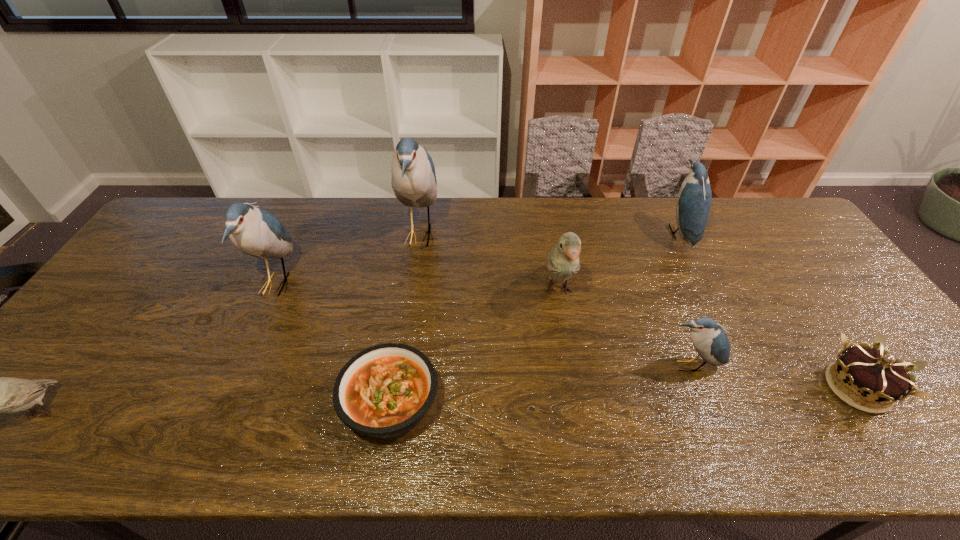
Image resolution: width=960 pixels, height=540 pixels. What are the coordinates of `bird that stands as the fourth closest to the farther white bird` in the screenshot? It's located at (254, 231).

Select which bird is the fifth closest to the leftmost bird. Please provide its 2D coordinates. Your answer should be formatted as a tuple, i.e. [(x, y)], where the tuple contains the x and y coordinates of a point satisfying the conditions above.

[(694, 198)]

This screenshot has height=540, width=960. Find the location of `blue bird that can be found as the fourth closest to the shortest object`. blue bird that can be found as the fourth closest to the shortest object is located at coordinates (694, 198).

Locate an element on the screen. The width and height of the screenshot is (960, 540). blue bird that is the fourth closest to the right white bird is located at coordinates (254, 231).

In order to click on free space in the image that satisfies the following two spatial constraints: 1. at the tip of the seventh tallest object's beak; 2. on the right side of the smallest blue bird in this screenshot , I will do `click(698, 388)`.

At what (x,y) coordinates should I click in order to perform the action: click on vacant space that satisfies the following two spatial constraints: 1. at the face of the fourth bird from left to right; 2. on the right side of the gold crown. Please return your answer as a coordinate pair (x, y). Image resolution: width=960 pixels, height=540 pixels. Looking at the image, I should click on click(574, 388).

The height and width of the screenshot is (540, 960). I want to click on vacant space that satisfies the following two spatial constraints: 1. at the face of the gold crown; 2. on the left side of the fifth object from left to right, so click(574, 388).

Where is `vacant space that satisfies the following two spatial constraints: 1. at the tip of the gold crown's beak; 2. on the left side of the second biggest blue bird`? vacant space that satisfies the following two spatial constraints: 1. at the tip of the gold crown's beak; 2. on the left side of the second biggest blue bird is located at coordinates (228, 388).